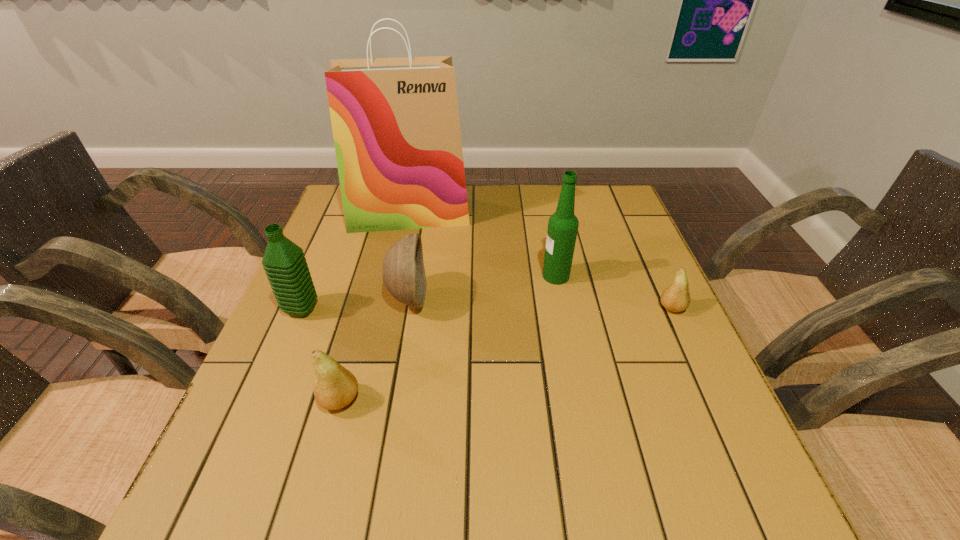
Identify the location of vacant space at the far left corner. (328, 213).

The height and width of the screenshot is (540, 960). In order to click on vacant space at the near right corner in this screenshot , I will do `click(680, 445)`.

At what (x,y) coordinates should I click in order to perform the action: click on free spot between the right pear and the left pear. Please return your answer as a coordinate pair (x, y). Looking at the image, I should click on (506, 354).

At what (x,y) coordinates should I click in order to perform the action: click on empty space that is in between the bowl and the fourth shortest object. Please return your answer as a coordinate pair (x, y). Looking at the image, I should click on (355, 304).

At what (x,y) coordinates should I click in order to perform the action: click on empty space between the shortest object and the third shortest object. Please return your answer as a coordinate pair (x, y). Looking at the image, I should click on (540, 303).

The height and width of the screenshot is (540, 960). I want to click on empty location between the fifth tallest object and the tallest object, so click(x=374, y=307).

Find the location of a particular element. Image resolution: width=960 pixels, height=540 pixels. free space that is in between the fourth shortest object and the beer bottle is located at coordinates (429, 293).

At what (x,y) coordinates should I click in order to perform the action: click on vacant area between the fifth shortest object and the taller pear. Please return your answer as a coordinate pair (x, y). The width and height of the screenshot is (960, 540). Looking at the image, I should click on (447, 338).

Identify the location of vacant point located between the water bottle and the farther pear. (487, 309).

Image resolution: width=960 pixels, height=540 pixels. Identify the location of vacant area that lies between the second tallest object and the third shortest object. (482, 287).